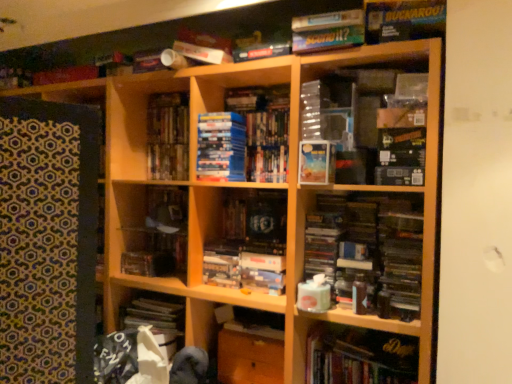
The image size is (512, 384). What do you see at coordinates (239, 343) in the screenshot?
I see `wooden cabinet at center, which ranks as the second cabinet in left-to-right order` at bounding box center [239, 343].

Image resolution: width=512 pixels, height=384 pixels. What do you see at coordinates (263, 130) in the screenshot? I see `blue cardboard book at center, which is counted as the third book, starting from the bottom` at bounding box center [263, 130].

What is the approximate width of wooden shelf at center, marked as the second cabinet in a right-to-left arrangement?

It is 12.02 inches.

At what (x,y) coordinates should I click in order to perform the action: click on wooden cabinet at center, the 2th cabinet positioned from the top. Please return your answer as a coordinate pair (x, y). Image resolution: width=512 pixels, height=384 pixels. Looking at the image, I should click on (239, 343).

Considering the relative sizes of matte blue paperback book at center and hardcover books at center, marked as the fourth book in a bottom-to-top arrangement, in the image provided, is matte blue paperback book at center wider than hardcover books at center, marked as the fourth book in a bottom-to-top arrangement,?

Correct, the width of matte blue paperback book at center exceeds that of hardcover books at center, marked as the fourth book in a bottom-to-top arrangement.

What's the angular difference between matte blue paperback book at center and hardcover books at center, marked as the fourth book in a bottom-to-top arrangement,'s facing directions?

There is a 0.00026-degree angle between the facing directions of matte blue paperback book at center and hardcover books at center, marked as the fourth book in a bottom-to-top arrangement.

Consider the image. Does matte blue paperback book at center come in front of hardcover books at center, which ranks as the 3th book in top-to-bottom order?

Yes, matte blue paperback book at center is in front of hardcover books at center, which ranks as the 3th book in top-to-bottom order.

Considering the sizes of matte blue paperback book at center and hardcover books at center, which ranks as the 3th book in top-to-bottom order, in the image, is matte blue paperback book at center taller or shorter than hardcover books at center, which ranks as the 3th book in top-to-bottom order,?

matte blue paperback book at center is shorter than hardcover books at center, which ranks as the 3th book in top-to-bottom order.

Is blue cardboard book at center, acting as the 4th book starting from the top, in front of or behind matte blue paperback book at center in the image?

blue cardboard book at center, acting as the 4th book starting from the top, is behind matte blue paperback book at center.

Between point (266, 175) and point (304, 152), which one is positioned in front?

The point (304, 152) is in front.

Between blue cardboard book at center, acting as the 4th book starting from the top, and matte blue paperback book at center, which one appears on the left side from the viewer's perspective?

blue cardboard book at center, acting as the 4th book starting from the top, is more to the left.

Is blue cardboard book at center, acting as the 4th book starting from the top, taller than matte blue paperback book at center?

Indeed, blue cardboard book at center, acting as the 4th book starting from the top, has a greater height compared to matte blue paperback book at center.

Relative to matte blue paperback book at center, is matte cardboard book at upper right, the 2th book when ordered from top to bottom, in front or behind?

Clearly, matte cardboard book at upper right, the 2th book when ordered from top to bottom, is in front of matte blue paperback book at center.

What's the angular difference between matte cardboard book at upper right, positioned as the fifth book in bottom-to-top order, and matte blue paperback book at center's facing directions?

0.000372 degrees separate the facing orientations of matte cardboard book at upper right, positioned as the fifth book in bottom-to-top order, and matte blue paperback book at center.

Are matte cardboard book at upper right, positioned as the fifth book in bottom-to-top order, and matte blue paperback book at center located far from each other?

No, matte cardboard book at upper right, positioned as the fifth book in bottom-to-top order, is not far from matte blue paperback book at center.

Could you measure the distance between matte cardboard book at upper right, positioned as the fifth book in bottom-to-top order, and matte blue paperback book at center?

A distance of 49.44 centimeters exists between matte cardboard book at upper right, positioned as the fifth book in bottom-to-top order, and matte blue paperback book at center.

Measure the distance between hardcover book at lower right, arranged as the first book when ordered from the bottom, and matte board game at upper center, which is the 1th book in top-to-bottom order.

hardcover book at lower right, arranged as the first book when ordered from the bottom, is 1.22 meters from matte board game at upper center, which is the 1th book in top-to-bottom order.

Is hardcover book at lower right, arranged as the first book when ordered from the bottom, further to the viewer compared to matte board game at upper center, which is the 1th book in top-to-bottom order?

Yes, the depth of hardcover book at lower right, arranged as the first book when ordered from the bottom, is greater than that of matte board game at upper center, which is the 1th book in top-to-bottom order.

Is hardcover book at lower right, acting as the sixth book starting from the top, oriented away from matte board game at upper center, which is the 1th book in top-to-bottom order?

hardcover book at lower right, acting as the sixth book starting from the top, does not have its back to matte board game at upper center, which is the 1th book in top-to-bottom order.

From a real-world perspective, is hardcover book at lower right, acting as the sixth book starting from the top, below matte board game at upper center, which is the 1th book in top-to-bottom order?

Indeed, from a real-world perspective, hardcover book at lower right, acting as the sixth book starting from the top, is positioned beneath matte board game at upper center, which is the 1th book in top-to-bottom order.

Considering the sizes of objects hardcover books at center, marked as the fourth book in a bottom-to-top arrangement, and blue cardboard book at center, which is counted as the third book, starting from the bottom, in the image provided, who is bigger, hardcover books at center, marked as the fourth book in a bottom-to-top arrangement, or blue cardboard book at center, which is counted as the third book, starting from the bottom,?

Bigger between the two is blue cardboard book at center, which is counted as the third book, starting from the bottom.

Are hardcover books at center, which ranks as the 3th book in top-to-bottom order, and blue cardboard book at center, which is counted as the third book, starting from the bottom, located far from each other?

No, there isn't a large distance between hardcover books at center, which ranks as the 3th book in top-to-bottom order, and blue cardboard book at center, which is counted as the third book, starting from the bottom.

From the image's perspective, is hardcover books at center, which ranks as the 3th book in top-to-bottom order, located above or below blue cardboard book at center, acting as the 4th book starting from the top?

hardcover books at center, which ranks as the 3th book in top-to-bottom order, is above blue cardboard book at center, acting as the 4th book starting from the top.

Does hardcover books at center, marked as the fourth book in a bottom-to-top arrangement, have a greater height compared to blue cardboard book at center, acting as the 4th book starting from the top?

In fact, hardcover books at center, marked as the fourth book in a bottom-to-top arrangement, may be shorter than blue cardboard book at center, acting as the 4th book starting from the top.

What's the angular difference between blue matte book at center, which ranks as the second book in bottom-to-top order, and matte cardboard book at upper right, positioned as the fifth book in bottom-to-top order,'s facing directions?

blue matte book at center, which ranks as the second book in bottom-to-top order, and matte cardboard book at upper right, positioned as the fifth book in bottom-to-top order, are facing 0.000824 degrees away from each other.

Which is nearer, (240,145) or (396,16)?

The point (396,16) is in front.

From a real-world perspective, is blue matte book at center, which is the 5th book in top-to-bottom order, over matte cardboard book at upper right, the 2th book when ordered from top to bottom?

Incorrect, from a real-world perspective, blue matte book at center, which is the 5th book in top-to-bottom order, is lower than matte cardboard book at upper right, the 2th book when ordered from top to bottom.

Does point (167, 125) come behind point (152, 298)?

Yes, it is behind point (152, 298).

Where is `cabinet lying on the left of hardcover books at center, which ranks as the 3th book in top-to-bottom order`? cabinet lying on the left of hardcover books at center, which ranks as the 3th book in top-to-bottom order is located at coordinates pyautogui.click(x=156, y=317).

Does hardcover books at center, which ranks as the 3th book in top-to-bottom order, have a larger size compared to wooden shelf at center, which ranks as the second cabinet in bottom-to-top order?

Actually, hardcover books at center, which ranks as the 3th book in top-to-bottom order, might be smaller than wooden shelf at center, which ranks as the second cabinet in bottom-to-top order.

The image size is (512, 384). I want to click on paperback book that appears on the right of hardcover books at center, marked as the fourth book in a bottom-to-top arrangement, so click(x=315, y=162).

I want to click on the 2nd book positioned above the matte blue paperback book at center (from the image's perspective), so click(x=263, y=130).

Looking at the image, which one is located closer to blue cardboard book at center, acting as the 4th book starting from the top, wooden shelf at center, the 1th cabinet when ordered from left to right, or matte board game at upper center, which is the 1th book in top-to-bottom order?

The object closer to blue cardboard book at center, acting as the 4th book starting from the top, is matte board game at upper center, which is the 1th book in top-to-bottom order.

Looking at the image, which one is located further to hardcover books at center, marked as the fourth book in a bottom-to-top arrangement, blue cardboard book at center, which is counted as the third book, starting from the bottom, or wooden shelf at center, which ranks as the second cabinet in bottom-to-top order?

Among the two, wooden shelf at center, which ranks as the second cabinet in bottom-to-top order, is located further to hardcover books at center, marked as the fourth book in a bottom-to-top arrangement.

Based on their spatial positions, is wooden cabinet at center, which is the 1th cabinet from bottom to top, or hardcover books at center, marked as the fourth book in a bottom-to-top arrangement, further from wooden shelf at center, which is the 1th cabinet from top to bottom?

hardcover books at center, marked as the fourth book in a bottom-to-top arrangement, lies further to wooden shelf at center, which is the 1th cabinet from top to bottom, than the other object.

In the scene shown: Based on their spatial positions, is matte cardboard book at upper right, the 2th book when ordered from top to bottom, or matte blue paperback book at center further from hardcover book at lower right, acting as the sixth book starting from the top?

Among the two, matte cardboard book at upper right, the 2th book when ordered from top to bottom, is located further to hardcover book at lower right, acting as the sixth book starting from the top.

Looking at the image, which one is located closer to wooden cabinet at center, which ranks as the second cabinet in left-to-right order, hardcover books at center, which ranks as the 3th book in top-to-bottom order, or blue cardboard book at center, acting as the 4th book starting from the top?

Based on the image, blue cardboard book at center, acting as the 4th book starting from the top, appears to be nearer to wooden cabinet at center, which ranks as the second cabinet in left-to-right order.

Considering their positions, is wooden shelf at center, which is the 1th cabinet from top to bottom, positioned closer to hardcover books at center, marked as the fourth book in a bottom-to-top arrangement, than hardcover book at lower right, acting as the sixth book starting from the top?

Based on the image, wooden shelf at center, which is the 1th cabinet from top to bottom, appears to be nearer to hardcover books at center, marked as the fourth book in a bottom-to-top arrangement.

From the image, which object appears to be nearer to matte cardboard book at upper right, the 2th book when ordered from top to bottom, blue cardboard book at center, acting as the 4th book starting from the top, or matte board game at upper center, the 6th book in the bottom-to-top sequence?

Among the two, matte board game at upper center, the 6th book in the bottom-to-top sequence, is located nearer to matte cardboard book at upper right, the 2th book when ordered from top to bottom.

Based on their spatial positions, is matte blue paperback book at center or hardcover book at lower right, acting as the sixth book starting from the top, closer to matte cardboard book at upper right, positioned as the fifth book in bottom-to-top order?

The object closer to matte cardboard book at upper right, positioned as the fifth book in bottom-to-top order, is matte blue paperback book at center.

Identify the location of paperback book between hardcover books at center, marked as the fourth book in a bottom-to-top arrangement, and wooden cabinet at center, which ranks as the second cabinet in left-to-right order, from top to bottom. (315, 162).

You are a GUI agent. You are given a task and a screenshot of the screen. Output one action in this format:
    pyautogui.click(x=<x>, y=<y>)
    Task: Click on the paperback book between hardcover books at center, marked as the fourth book in a bottom-to-top arrangement, and wooden shelf at center, marked as the second cabinet in a right-to-left arrangement, in the vertical direction
    This screenshot has width=512, height=384.
    Given the screenshot: What is the action you would take?
    pyautogui.click(x=315, y=162)

Locate an element on the screen. The width and height of the screenshot is (512, 384). paperback book situated between hardcover books at center, marked as the fourth book in a bottom-to-top arrangement, and matte board game at upper center, which is the 1th book in top-to-bottom order, from left to right is located at coordinates (315, 162).

Find the location of a particular element. book between matte blue paperback book at center and wooden cabinet at center, which ranks as the second cabinet in left-to-right order, in the vertical direction is located at coordinates (360, 357).